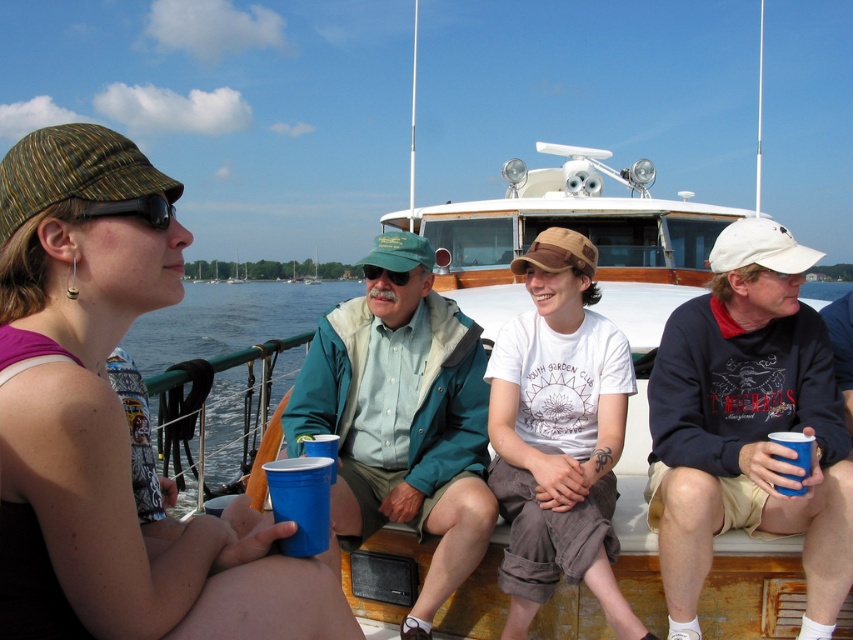
You are a photographer trying to capture a closeup of the green matte sunglasses at center without including the black rubber goggles at upper left in the frame. Is this possible given their positions?

The black rubber goggles at upper left is positioned over the green matte sunglasses at center, so the goggles would block the sunglasses from view. Therefore, it is not possible to capture a closeup of the green matte sunglasses at center without including the black rubber goggles at upper left in the frame.

You are standing on the deck of the boat and want to place a new decorative item at the exact coordinates where the matte green cap at upper left is located. According to the scene description, what are the coordinates where you should place the item?

The coordinates for the matte green cap at upper left are at point (111, 422), so you should place the decorative item at those coordinates.

You are standing on the deck of the boat and want to move from the point at coordinates point [144,212] to the point at coordinates point [380,273]. Which direction should you move in?

You should move backward because point [144,212] is in front of point [380,273], so moving backward will take you towards the desired point.